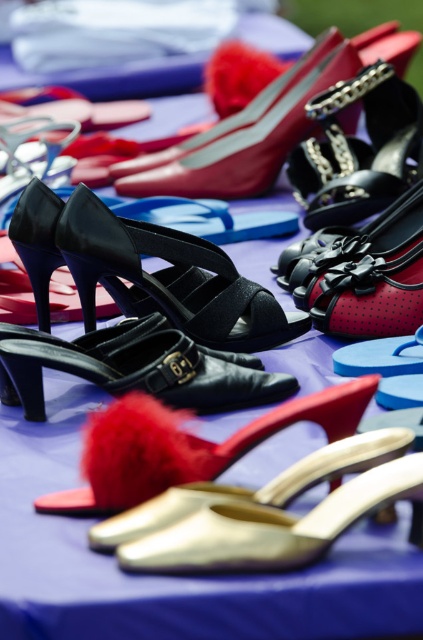
What is the 2D coordinate of the gold metallic sandal at lower center?

The gold metallic sandal at lower center is located at the 2D coordinate of point (280, 515).